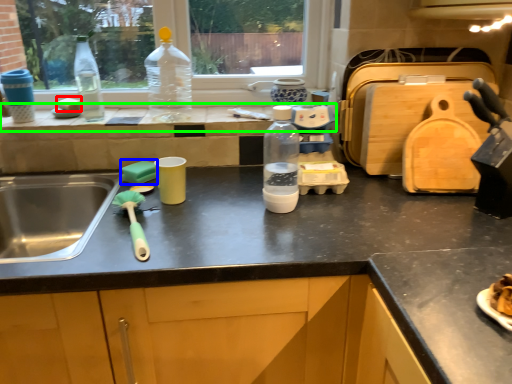
Question: Which is farther away from food (highlighted by a red box)? food (highlighted by a blue box) or window sill (highlighted by a green box)?

Choices:
 (A) food
 (B) window sill

Answer: (A)